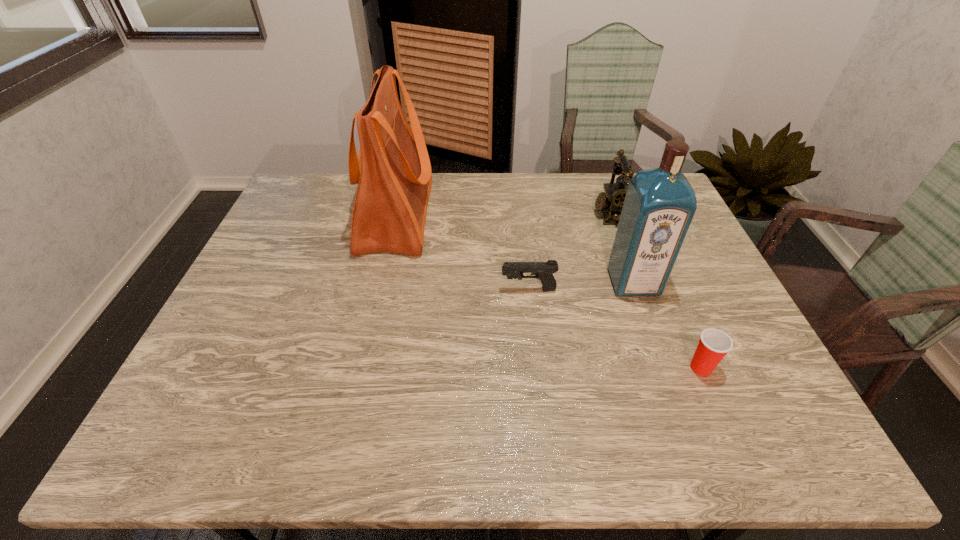
The image size is (960, 540). What are the coordinates of `shopping bag` in the screenshot? It's located at pos(393,172).

Identify the location of liquor. The width and height of the screenshot is (960, 540). [x=660, y=203].

You are a GUI agent. You are given a task and a screenshot of the screen. Output one action in this format:
    pyautogui.click(x=<x>, y=<y>)
    Task: Click on the third tallest object
    The height and width of the screenshot is (540, 960).
    Given the screenshot: What is the action you would take?
    613,198

Where is `pistol`? pistol is located at coordinates (543, 271).

Locate an element on the screen. the nearest object is located at coordinates (714, 344).

The height and width of the screenshot is (540, 960). What are the coordinates of `vacant space located 0.070m on the front pocket of the shopping bag` in the screenshot? It's located at (455, 215).

Where is `vacant area located 0.300m on the flat label side of the liquor`? This screenshot has height=540, width=960. vacant area located 0.300m on the flat label side of the liquor is located at coordinates (676, 402).

In order to click on blank area located on the rotary dial of the telephone in this screenshot , I will do `click(525, 213)`.

This screenshot has height=540, width=960. Identify the location of vacant space situated 0.190m on the rotary dial of the telephone. (534, 213).

You are a GUI agent. You are given a task and a screenshot of the screen. Output one action in this format:
    pyautogui.click(x=<x>, y=<y>)
    Task: Click on the free location located 0.380m on the rotary dial of the telephone
    The width and height of the screenshot is (960, 540).
    Given the screenshot: What is the action you would take?
    pyautogui.click(x=475, y=213)